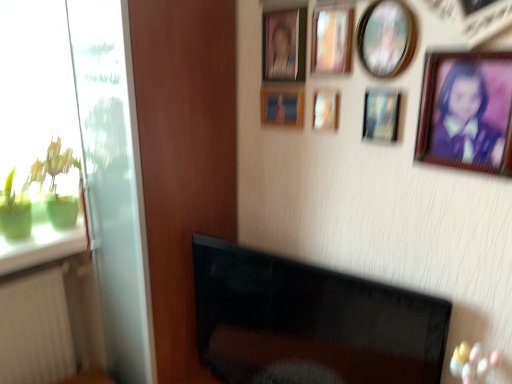
In order to face wooden picture frame at upper center, which is counted as the 4th picture frame, starting from the left, should I rotate leftwards or rightwards?

To face it directly, rotate right by 9.992 degrees.

This screenshot has height=384, width=512. I want to click on wooden picture frame at upper center, marked as the 4th picture frame in a right-to-left arrangement, so click(332, 40).

What is the approximate width of green glass at left?

11.25 inches.

This screenshot has width=512, height=384. What do you see at coordinates (42, 246) in the screenshot? I see `green glass at left` at bounding box center [42, 246].

Image resolution: width=512 pixels, height=384 pixels. Describe the element at coordinates (381, 115) in the screenshot. I see `wooden picture frame at upper center, which is counted as the second picture frame, starting from the right` at that location.

This screenshot has height=384, width=512. Describe the element at coordinates (325, 109) in the screenshot. I see `wooden picture frame at upper center, the 5th picture frame in the right-to-left sequence` at that location.

What is the approximate height of wooden picture frame at upper center, the 1th picture frame in the left-to-right sequence?

wooden picture frame at upper center, the 1th picture frame in the left-to-right sequence, is 12.98 centimeters tall.

You are a GUI agent. You are given a task and a screenshot of the screen. Output one action in this format:
    pyautogui.click(x=<x>, y=<y>)
    Task: Click on the wooden picture frame at upper center, the 1th picture frame in the left-to-right sequence
    The width and height of the screenshot is (512, 384).
    Given the screenshot: What is the action you would take?
    pyautogui.click(x=282, y=104)

I want to click on transparent glass door at left, so click(x=113, y=183).

This screenshot has height=384, width=512. Find the location of `wooden picture frame at upper center, which is counted as the 4th picture frame, starting from the left`. wooden picture frame at upper center, which is counted as the 4th picture frame, starting from the left is located at coordinates 332,40.

From the picture: From a real-world perspective, does white plastic radiator at lower left sit lower than green glass at left?

Yes, from a real-world perspective, white plastic radiator at lower left is beneath green glass at left.

Between white plastic radiator at lower left and green glass at left, which one has smaller size?

Smaller between the two is green glass at left.

Can you confirm if white plastic radiator at lower left is positioned to the right of green glass at left?

Incorrect, white plastic radiator at lower left is not on the right side of green glass at left.

Does wooden picture frame at upper center, acting as the 7th picture frame starting from the right, appear on the left side of wooden picture frame at upper center, which ranks as the sixth picture frame in left-to-right order?

Correct, you'll find wooden picture frame at upper center, acting as the 7th picture frame starting from the right, to the left of wooden picture frame at upper center, which ranks as the sixth picture frame in left-to-right order.

Does point (260, 99) come closer to viewer compared to point (382, 89)?

No, (260, 99) is further to viewer.

From a real-world perspective, is wooden picture frame at upper center, the 1th picture frame in the left-to-right sequence, physically below wooden picture frame at upper center, which ranks as the sixth picture frame in left-to-right order?

Indeed, from a real-world perspective, wooden picture frame at upper center, the 1th picture frame in the left-to-right sequence, is positioned beneath wooden picture frame at upper center, which ranks as the sixth picture frame in left-to-right order.

Is wooden picture frame at upper center, acting as the 7th picture frame starting from the right, far away from wooden picture frame at upper center, which ranks as the sixth picture frame in left-to-right order?

That's not correct — wooden picture frame at upper center, acting as the 7th picture frame starting from the right, is a little close to wooden picture frame at upper center, which ranks as the sixth picture frame in left-to-right order.

From the image's perspective, between transparent glass door at left and wooden picture frame at upper center, which is counted as the second picture frame, starting from the right, who is located below?

transparent glass door at left appears lower in the image.

This screenshot has width=512, height=384. I want to click on glass door lying on the left of wooden picture frame at upper center, which ranks as the sixth picture frame in left-to-right order, so pyautogui.click(x=113, y=183).

In the scene shown: Is transparent glass door at left next to wooden picture frame at upper center, which ranks as the sixth picture frame in left-to-right order, and touching it?

No, transparent glass door at left is not touching wooden picture frame at upper center, which ranks as the sixth picture frame in left-to-right order.

Looking at this image, are wooden picture frame at upper right, acting as the seventh picture frame starting from the left, and transparent glass door at left far apart?

wooden picture frame at upper right, acting as the seventh picture frame starting from the left, is near transparent glass door at left, not far away.

Could you tell me if wooden picture frame at upper right, acting as the seventh picture frame starting from the left, is turned towards transparent glass door at left?

No, wooden picture frame at upper right, acting as the seventh picture frame starting from the left, is not aimed at transparent glass door at left.

What's the angular difference between wooden picture frame at upper right, the 1th picture frame when ordered from right to left, and transparent glass door at left's facing directions?

wooden picture frame at upper right, the 1th picture frame when ordered from right to left, and transparent glass door at left are facing 0.588 degrees away from each other.

Which object is more forward, wooden picture frame at upper right, acting as the seventh picture frame starting from the left, or transparent glass door at left?

wooden picture frame at upper right, acting as the seventh picture frame starting from the left.

Between point (393, 122) and point (135, 108), which one is positioned behind?

Point (135, 108)

Is wooden picture frame at upper center, which is counted as the second picture frame, starting from the right, taller or shorter than transparent glass door at left?

In the image, wooden picture frame at upper center, which is counted as the second picture frame, starting from the right, appears to be shorter than transparent glass door at left.

From the image's perspective, is wooden picture frame at upper center, which is counted as the second picture frame, starting from the right, above or below transparent glass door at left?

Clearly, from the image's perspective, wooden picture frame at upper center, which is counted as the second picture frame, starting from the right, is above transparent glass door at left.

Relative to transparent glass door at left, is wooden picture frame at upper center, which is counted as the second picture frame, starting from the right, in front or behind?

wooden picture frame at upper center, which is counted as the second picture frame, starting from the right, is in front of transparent glass door at left.

Is wooden picture frame at upper center, marked as the 4th picture frame in a right-to-left arrangement, far away from wooden picture frame at upper center, acting as the 7th picture frame starting from the right?

That's not correct — wooden picture frame at upper center, marked as the 4th picture frame in a right-to-left arrangement, is a little close to wooden picture frame at upper center, acting as the 7th picture frame starting from the right.

Is wooden picture frame at upper center, marked as the 4th picture frame in a right-to-left arrangement, positioned with its back to wooden picture frame at upper center, the 1th picture frame in the left-to-right sequence?

No, wooden picture frame at upper center, marked as the 4th picture frame in a right-to-left arrangement,'s orientation is not away from wooden picture frame at upper center, the 1th picture frame in the left-to-right sequence.

The width and height of the screenshot is (512, 384). What are the coordinates of `picture frame that is the 3rd one when counting forward from the wooden picture frame at upper center, acting as the 7th picture frame starting from the right` in the screenshot? It's located at (332, 40).

Relative to wooden picture frame at upper center, the 1th picture frame in the left-to-right sequence, is wooden picture frame at upper center, which is counted as the 4th picture frame, starting from the left, in front or behind?

Clearly, wooden picture frame at upper center, which is counted as the 4th picture frame, starting from the left, is in front of wooden picture frame at upper center, the 1th picture frame in the left-to-right sequence.

From a real-world perspective, who is located lower, wooden picture frame at upper center, which is counted as the 4th picture frame, starting from the left, or white plastic radiator at lower left?

From a 3D spatial view, white plastic radiator at lower left is below.

Can you see wooden picture frame at upper center, which is counted as the 4th picture frame, starting from the left, touching white plastic radiator at lower left?

No, wooden picture frame at upper center, which is counted as the 4th picture frame, starting from the left, is not beside white plastic radiator at lower left.

Between wooden picture frame at upper center, marked as the 4th picture frame in a right-to-left arrangement, and white plastic radiator at lower left, which one has smaller size?

wooden picture frame at upper center, marked as the 4th picture frame in a right-to-left arrangement.

Does point (334, 35) come in front of point (19, 376)?

Yes, point (334, 35) is in front of point (19, 376).

At what (x,y) coordinates should I click in order to perform the action: click on window sill in front of the white plastic radiator at lower left. Please return your answer as a coordinate pair (x, y). The image size is (512, 384). Looking at the image, I should click on (42, 246).

Find the location of `picture frame that is the 5th one when counting rightward from the wooden picture frame at upper center, the 1th picture frame in the left-to-right sequence`. picture frame that is the 5th one when counting rightward from the wooden picture frame at upper center, the 1th picture frame in the left-to-right sequence is located at coordinates (381, 115).

Based on their spatial positions, is wooden picture frame at upper right, the 1th picture frame when ordered from right to left, or wooden picture frame at upper center, the 5th picture frame in the right-to-left sequence, further from matte plastic picture frame at upper center, which is the 2th picture frame from left to right?

Among the two, wooden picture frame at upper right, the 1th picture frame when ordered from right to left, is located further to matte plastic picture frame at upper center, which is the 2th picture frame from left to right.

Looking at the image, which one is located closer to wooden picture frame at upper center, marked as the 3th picture frame in a left-to-right arrangement, wooden picture frame at upper right, the 1th picture frame when ordered from right to left, or matte plastic picture frame at upper center, arranged as the sixth picture frame when viewed from the right?

The object closer to wooden picture frame at upper center, marked as the 3th picture frame in a left-to-right arrangement, is matte plastic picture frame at upper center, arranged as the sixth picture frame when viewed from the right.

From the image, which object appears to be nearer to wooden picture frame at upper center, which is counted as the second picture frame, starting from the right, transparent glass door at left or wooden picture frame at upper center, marked as the 5th picture frame in a left-to-right arrangement?

wooden picture frame at upper center, marked as the 5th picture frame in a left-to-right arrangement, lies closer to wooden picture frame at upper center, which is counted as the second picture frame, starting from the right, than the other object.

Based on their spatial positions, is wooden picture frame at upper center, marked as the 3th picture frame in a left-to-right arrangement, or wooden picture frame at upper center, marked as the 4th picture frame in a right-to-left arrangement, closer to wooden picture frame at upper center, the 3th picture frame positioned from the right?

wooden picture frame at upper center, marked as the 4th picture frame in a right-to-left arrangement, is closer to wooden picture frame at upper center, the 3th picture frame positioned from the right.

When comparing their distances from matte plastic picture frame at upper center, arranged as the sixth picture frame when viewed from the right, does white plastic radiator at lower left or wooden picture frame at upper center, which ranks as the sixth picture frame in left-to-right order, seem closer?

Based on the image, wooden picture frame at upper center, which ranks as the sixth picture frame in left-to-right order, appears to be nearer to matte plastic picture frame at upper center, arranged as the sixth picture frame when viewed from the right.

Which object lies nearer to the anchor point green glass at left, matte plastic picture frame at upper center, arranged as the sixth picture frame when viewed from the right, or wooden picture frame at upper center, which is counted as the second picture frame, starting from the right?

matte plastic picture frame at upper center, arranged as the sixth picture frame when viewed from the right, is closer to green glass at left.

When comparing their distances from wooden picture frame at upper right, acting as the seventh picture frame starting from the left, does wooden picture frame at upper center, marked as the 5th picture frame in a left-to-right arrangement, or transparent glass door at left seem closer?

Among the two, wooden picture frame at upper center, marked as the 5th picture frame in a left-to-right arrangement, is located nearer to wooden picture frame at upper right, acting as the seventh picture frame starting from the left.

Considering their positions, is wooden picture frame at upper center, which ranks as the sixth picture frame in left-to-right order, positioned closer to matte plastic picture frame at upper center, which is the 2th picture frame from left to right, than wooden picture frame at upper center, the 1th picture frame in the left-to-right sequence?

wooden picture frame at upper center, the 1th picture frame in the left-to-right sequence, is closer to matte plastic picture frame at upper center, which is the 2th picture frame from left to right.

You are a GUI agent. You are given a task and a screenshot of the screen. Output one action in this format:
    pyautogui.click(x=<x>, y=<y>)
    Task: Click on the glass door located between green glass at left and wooden picture frame at upper center, the 1th picture frame in the left-to-right sequence, in the left-right direction
    
    Given the screenshot: What is the action you would take?
    pyautogui.click(x=113, y=183)

Where is `glass door situated between white plastic radiator at lower left and wooden picture frame at upper center, which is counted as the second picture frame, starting from the right, from left to right`? The height and width of the screenshot is (384, 512). glass door situated between white plastic radiator at lower left and wooden picture frame at upper center, which is counted as the second picture frame, starting from the right, from left to right is located at coordinates (113, 183).

Where is `window sill between white plastic radiator at lower left and wooden picture frame at upper center, marked as the 4th picture frame in a right-to-left arrangement, from left to right`? window sill between white plastic radiator at lower left and wooden picture frame at upper center, marked as the 4th picture frame in a right-to-left arrangement, from left to right is located at coordinates (42, 246).

At what (x,y) coordinates should I click in order to perform the action: click on glass door between white plastic radiator at lower left and wooden picture frame at upper right, the 1th picture frame when ordered from right to left, from left to right. Please return your answer as a coordinate pair (x, y). The width and height of the screenshot is (512, 384). Looking at the image, I should click on (113, 183).